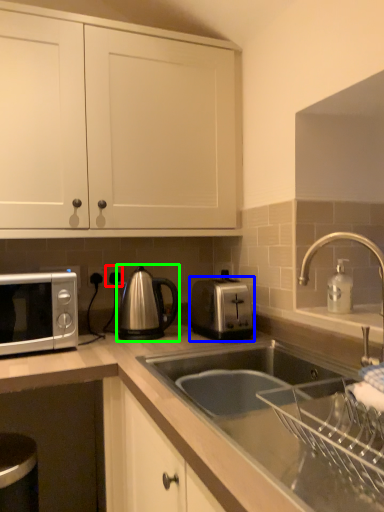
Question: Which object is positioned farthest from electric outlet (highlighted by a red box)? Select from toaster (highlighted by a blue box) and tea pot (highlighted by a green box).

Choices:
 (A) toaster
 (B) tea pot

Answer: (A)